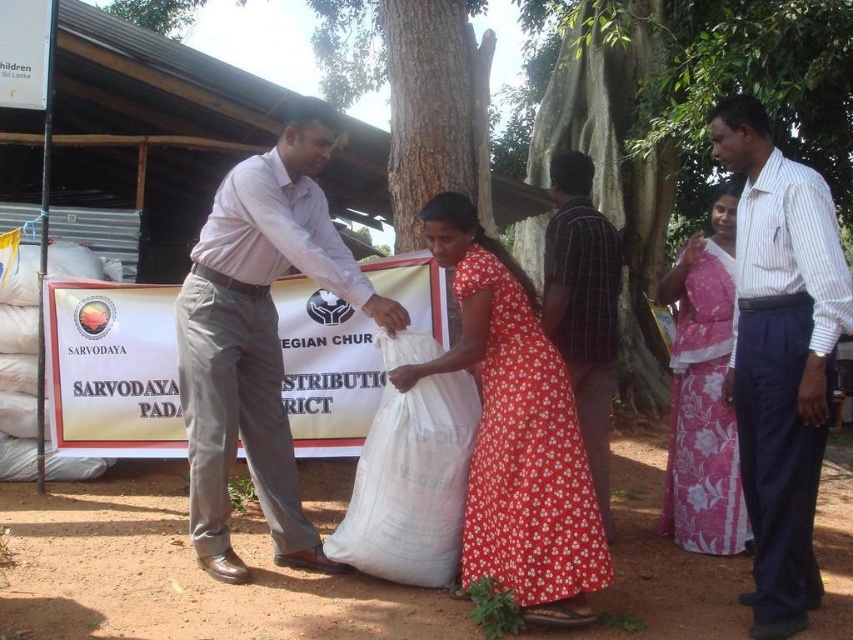
You are a photographer positioned at the back of the scene. You want to take a photo that includes both the floral cotton dress at center and the pink floral fabric dress at right. What is the minimum distance you need to move forward to ensure both dresses are in frame?

The floral cotton dress at center and pink floral fabric dress at right are 39.10 inches apart from each other. To capture both in a single frame, you need to move forward until the camera can encompass a span of at least 39.10 inches between them, ensuring both dresses are within the field of view.

You are a photographer positioned to capture the scene where a man in a white striped shirt at right is interacting with a woman. There is also a green leafy tree at upper center in the background. Which object is closer to you, the photographer?

The white striped shirt at right is closer to the photographer than the green leafy tree at upper center.